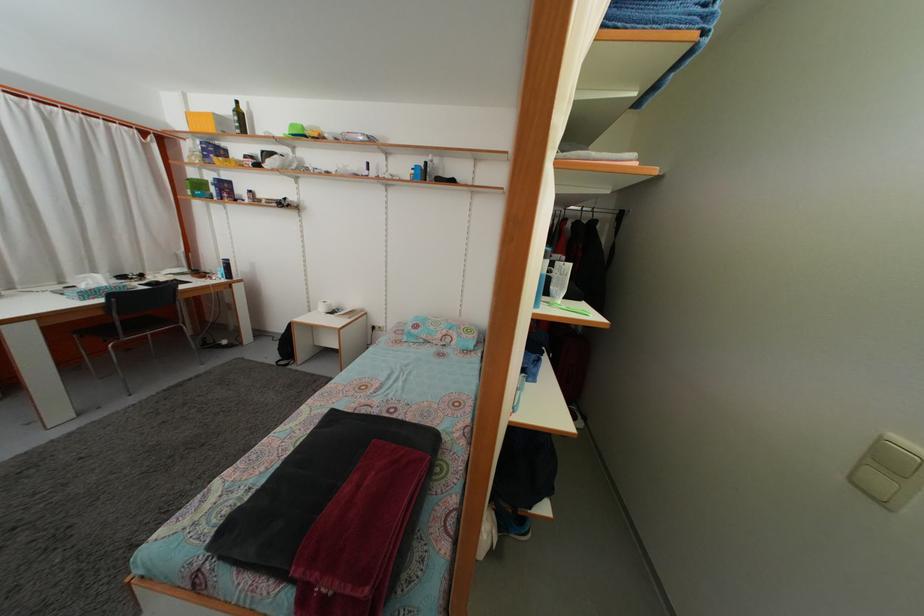
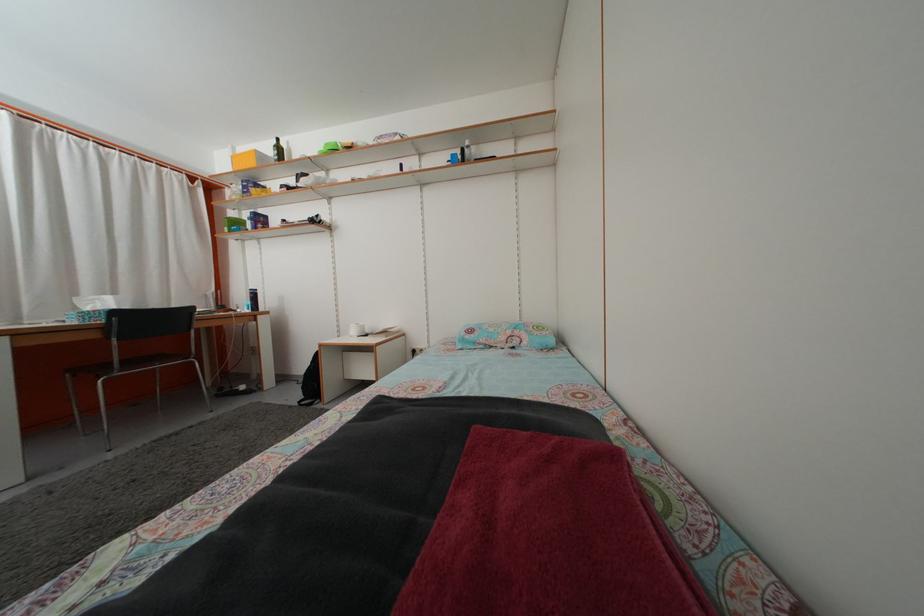
Question: The images are taken continuously from a first-person perspective. In which direction is your viewpoint rotating?

Choices:
 (A) Left
 (B) Right
 (C) Up
 (D) Down

Answer: (C)